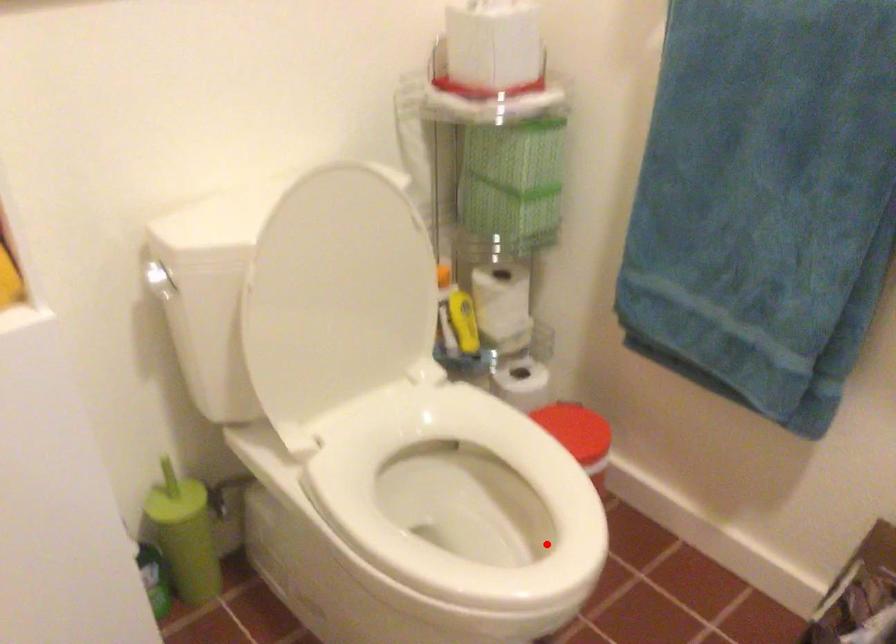
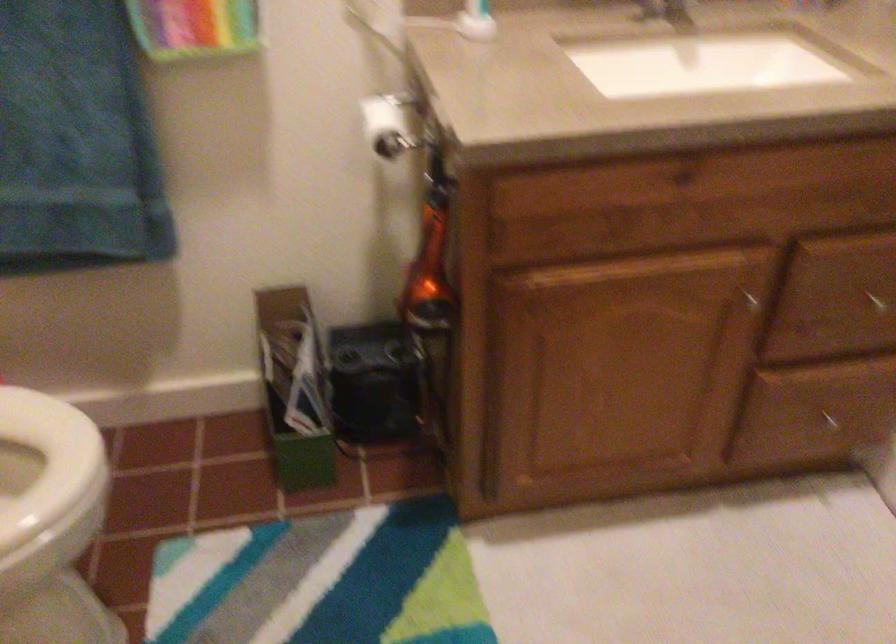
Question: I am providing you with two images of the same scene from different viewpoints. In image1, a red point is highlighted. Considering the same 3D point in image2, which of the following is correct?

Choices:
 (A) It is closer
 (B) It is farther

Answer: (A)